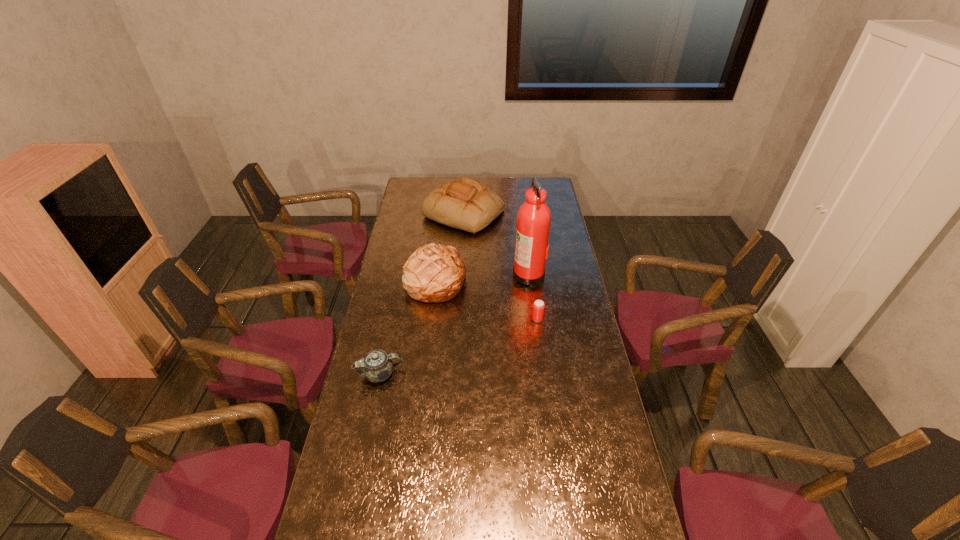
At what (x,y) coordinates should I click in order to perform the action: click on the tallest object. Please return your answer as a coordinate pair (x, y). This screenshot has width=960, height=540. Looking at the image, I should click on (533, 222).

This screenshot has height=540, width=960. What are the coordinates of `the farthest object` in the screenshot? It's located at (466, 204).

The width and height of the screenshot is (960, 540). In order to click on the nearer bread in this screenshot , I will do `click(434, 273)`.

Locate an element on the screen. The height and width of the screenshot is (540, 960). the nearest object is located at coordinates (376, 366).

Identify the location of the fourth farthest object. (538, 308).

You are a GUI agent. You are given a task and a screenshot of the screen. Output one action in this format:
    pyautogui.click(x=<x>, y=<y>)
    Task: Click on the beer can
    The height and width of the screenshot is (540, 960).
    Given the screenshot: What is the action you would take?
    pyautogui.click(x=538, y=308)

Where is `vacant space located 0.080m on the label side of the fire extinguisher`? This screenshot has width=960, height=540. vacant space located 0.080m on the label side of the fire extinguisher is located at coordinates (494, 274).

Identify the location of free space located on the label side of the fire extinguisher. (462, 274).

The height and width of the screenshot is (540, 960). In order to click on free spot located on the label side of the fire extinguisher in this screenshot , I will do `click(441, 274)`.

Identify the location of free region located on the right of the farthest object. The width and height of the screenshot is (960, 540). (538, 213).